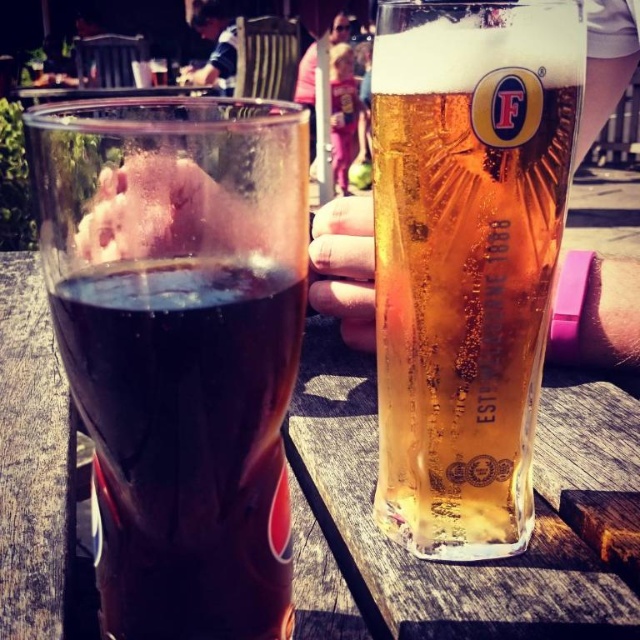
Question: Does transparent glass at center appear on the left side of wooden table at center?

Choices:
 (A) yes
 (B) no

Answer: (B)

Question: Which object is positioned closest to the golden glass beer at center?

Choices:
 (A) transparent glass at center
 (B) wooden table at center

Answer: (A)

Question: Which point is farther from the camera taking this photo?

Choices:
 (A) (557, 611)
 (B) (412, 294)
 (C) (134, 408)

Answer: (B)

Question: Can you confirm if golden glass beer at center is wider than wooden table at center?

Choices:
 (A) no
 (B) yes

Answer: (A)

Question: Does transparent glass at center lie behind wooden table at center?

Choices:
 (A) no
 (B) yes

Answer: (A)

Question: Which of these objects is positioned closest to the transparent glass at center?

Choices:
 (A) golden glass beer at center
 (B) wooden table at center

Answer: (A)